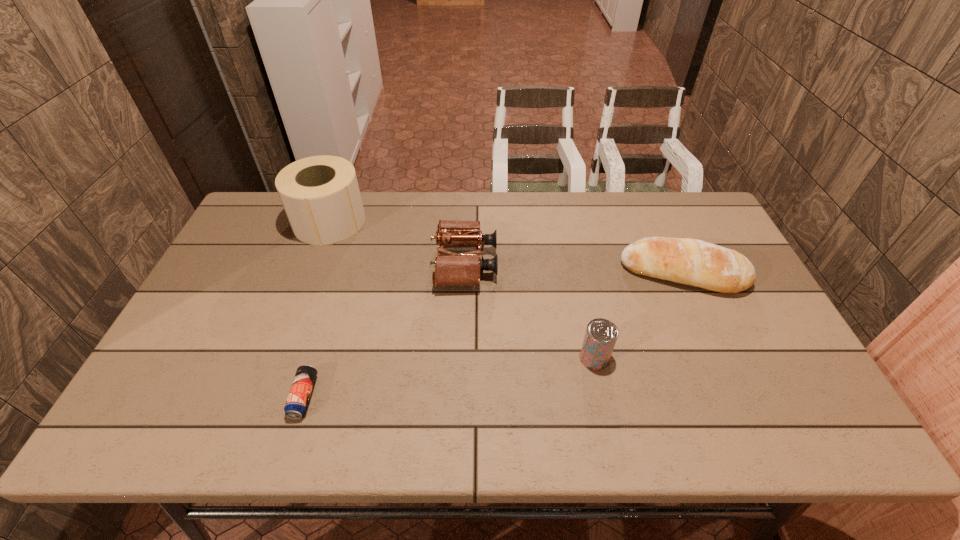
This screenshot has height=540, width=960. What are the coordinates of `vacant region at the near left corner of the desktop` in the screenshot? It's located at (138, 431).

This screenshot has height=540, width=960. What are the coordinates of `vacant space at the far right corner of the desktop` in the screenshot? It's located at (670, 206).

Identify the location of vacant space that's between the fourth farthest object and the toilet tissue. The width and height of the screenshot is (960, 540). (462, 290).

You are a GUI agent. You are given a task and a screenshot of the screen. Output one action in this format:
    pyautogui.click(x=<x>, y=<y>)
    Task: Click on the vacant region between the bread and the left beer can
    Image resolution: width=960 pixels, height=540 pixels.
    Given the screenshot: What is the action you would take?
    pyautogui.click(x=493, y=335)

This screenshot has height=540, width=960. What are the coordinates of `free point between the third object from left to right and the fourth farthest object` in the screenshot? It's located at (530, 311).

Image resolution: width=960 pixels, height=540 pixels. In order to click on empty location between the left beer can and the tallest object in this screenshot , I will do `click(317, 309)`.

The height and width of the screenshot is (540, 960). Find the location of `vacant point located between the bread and the tallest object`. vacant point located between the bread and the tallest object is located at coordinates (506, 248).

The width and height of the screenshot is (960, 540). What are the coordinates of `free spot between the rightmost object and the binoculars` in the screenshot? It's located at (574, 269).

You are a GUI agent. You are given a task and a screenshot of the screen. Output one action in this format:
    pyautogui.click(x=<x>, y=<y>)
    Task: Click on the vacant area that lies between the nearer beer can and the bread
    
    Given the screenshot: What is the action you would take?
    pyautogui.click(x=493, y=335)

You are a GUI agent. You are given a task and a screenshot of the screen. Output one action in this format:
    pyautogui.click(x=<x>, y=<y>)
    Task: Click on the blank region between the shorter beer can and the right beer can
    This screenshot has height=540, width=960.
    Given the screenshot: What is the action you would take?
    pyautogui.click(x=449, y=377)